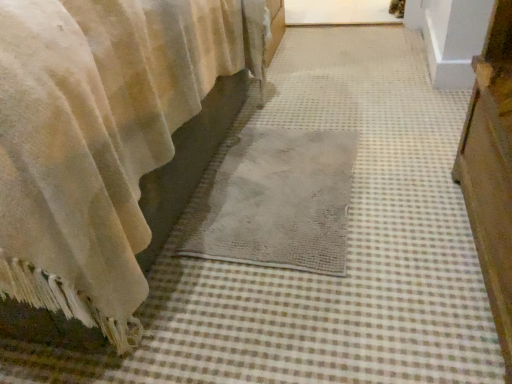
In order to face velvet beige curtain at lower left, should I rotate leftwards or rightwards?

Rotate left and turn 32.592 degrees.

Locate an element on the screen. The height and width of the screenshot is (384, 512). velvet beige curtain at lower left is located at coordinates (100, 138).

Describe the element at coordinates (100, 138) in the screenshot. I see `velvet beige curtain at lower left` at that location.

Where is `gray woven mat at center`? This screenshot has height=384, width=512. gray woven mat at center is located at coordinates (277, 201).

Measure the distance between point (x=229, y=249) and camera.

Point (x=229, y=249) is 4.06 feet away from camera.

Image resolution: width=512 pixels, height=384 pixels. What do you see at coordinates (277, 201) in the screenshot?
I see `gray woven mat at center` at bounding box center [277, 201].

Where is `velvet beige curtain at lower left`? velvet beige curtain at lower left is located at coordinates (100, 138).

Is gray woven mat at center to the right of velvet beige curtain at lower left from the viewer's perspective?

Indeed, gray woven mat at center is positioned on the right side of velvet beige curtain at lower left.

Which object is further away from the camera taking this photo, gray woven mat at center or velvet beige curtain at lower left?

Positioned behind is gray woven mat at center.

Which is less distant, (204, 190) or (92, 13)?

The point (92, 13) is more forward.

From the image's perspective, between gray woven mat at center and velvet beige curtain at lower left, who is located below?

gray woven mat at center is shown below in the image.

From a real-world perspective, does gray woven mat at center stand above velvet beige curtain at lower left?

No, from a real-world perspective, gray woven mat at center is not above velvet beige curtain at lower left.

Does gray woven mat at center have a greater width compared to velvet beige curtain at lower left?

In fact, gray woven mat at center might be narrower than velvet beige curtain at lower left.

Looking at this image, considering the sizes of gray woven mat at center and velvet beige curtain at lower left in the image, is gray woven mat at center taller or shorter than velvet beige curtain at lower left?

In the image, gray woven mat at center appears to be shorter than velvet beige curtain at lower left.

Considering the relative sizes of gray woven mat at center and velvet beige curtain at lower left in the image provided, is gray woven mat at center bigger than velvet beige curtain at lower left?

No.

Can we say gray woven mat at center lies outside velvet beige curtain at lower left?

Yes, gray woven mat at center is outside of velvet beige curtain at lower left.

Is gray woven mat at center touching velvet beige curtain at lower left?

No, gray woven mat at center is not making contact with velvet beige curtain at lower left.

Could you tell me if gray woven mat at center is facing velvet beige curtain at lower left?

No.

How different are the orientations of gray woven mat at center and velvet beige curtain at lower left in degrees?

The angle between the facing direction of gray woven mat at center and the facing direction of velvet beige curtain at lower left is 1.91 degrees.

Measure the distance between gray woven mat at center and velvet beige curtain at lower left.

17.83 inches.

Find the location of a particular element. mat on the right of velvet beige curtain at lower left is located at coordinates (277, 201).

Considering the relative positions of velvet beige curtain at lower left and gray woven mat at center in the image provided, is velvet beige curtain at lower left to the left of gray woven mat at center from the viewer's perspective?

Indeed, velvet beige curtain at lower left is positioned on the left side of gray woven mat at center.

Which object is further away from the camera, velvet beige curtain at lower left or gray woven mat at center?

gray woven mat at center.

Which point is more forward, (103, 114) or (279, 225)?

Point (103, 114)

From the image's perspective, does velvet beige curtain at lower left appear lower than gray woven mat at center?

Actually, velvet beige curtain at lower left appears above gray woven mat at center in the image.

From a real-world perspective, is velvet beige curtain at lower left on gray woven mat at center?

Yes, from a real-world perspective, velvet beige curtain at lower left is on top of gray woven mat at center.

Considering the sizes of velvet beige curtain at lower left and gray woven mat at center in the image, is velvet beige curtain at lower left wider or thinner than gray woven mat at center?

Clearly, velvet beige curtain at lower left has more width compared to gray woven mat at center.

Who is shorter, velvet beige curtain at lower left or gray woven mat at center?

gray woven mat at center is shorter.

Is velvet beige curtain at lower left smaller than gray woven mat at center?

No.

Is velvet beige curtain at lower left located outside gray woven mat at center?

Indeed, velvet beige curtain at lower left is completely outside gray woven mat at center.

Are velvet beige curtain at lower left and gray woven mat at center far apart?

No, velvet beige curtain at lower left is not far from gray woven mat at center.

Could you tell me if velvet beige curtain at lower left is facing gray woven mat at center?

Yes, velvet beige curtain at lower left is oriented towards gray woven mat at center.

Locate an element on the screen. The image size is (512, 384). mat below the velvet beige curtain at lower left (from the image's perspective) is located at coordinates (277, 201).

Locate an element on the screen. This screenshot has width=512, height=384. curtain above the gray woven mat at center (from the image's perspective) is located at coordinates (100, 138).

Image resolution: width=512 pixels, height=384 pixels. I want to click on curtain on the left of the gray woven mat at center, so click(x=100, y=138).